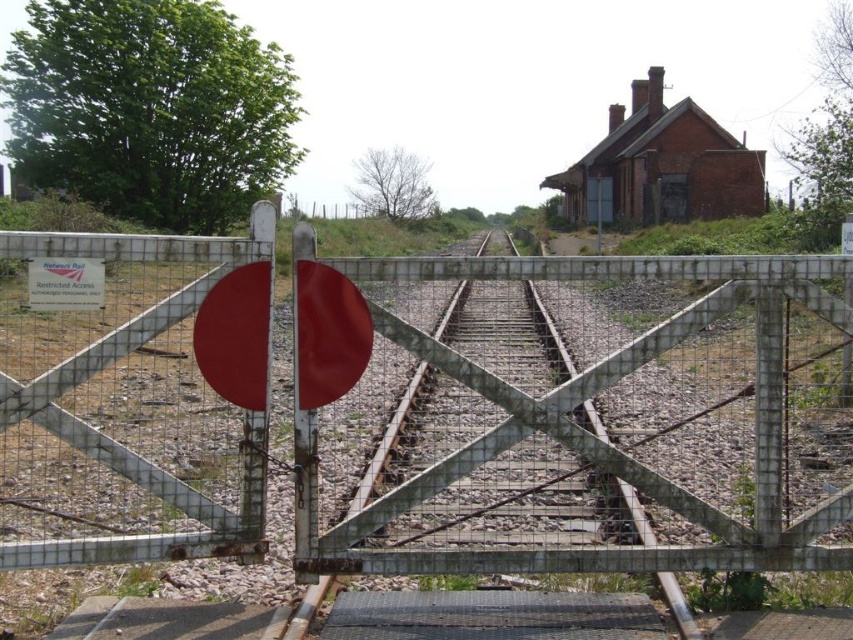
You are a delivery truck driver who needs to pass through the railway crossing. You see the metal mesh gate at center and the smooth metal train track at center. Can you determine if your truck can pass through the opening between them?

The metal mesh gate at center might be wider than smooth metal train track at center, so there might be enough space for the truck to pass through the opening between them.

You are a railway inspector checking the crossing. You need to access the tracks for inspection. The metal mesh gate at center is blocking your path. Can you move around it to reach the smooth metal train track at center? Explain how.

The metal mesh gate at center is to the left of the smooth metal train track at center. Since the gate is blocking the path, you can move around it by going to the right side of the gate to access the tracks.

You are standing at the point with coordinates point (422,408). What object is exactly at your current location?

The metal mesh gate at center is located at point (422,408).